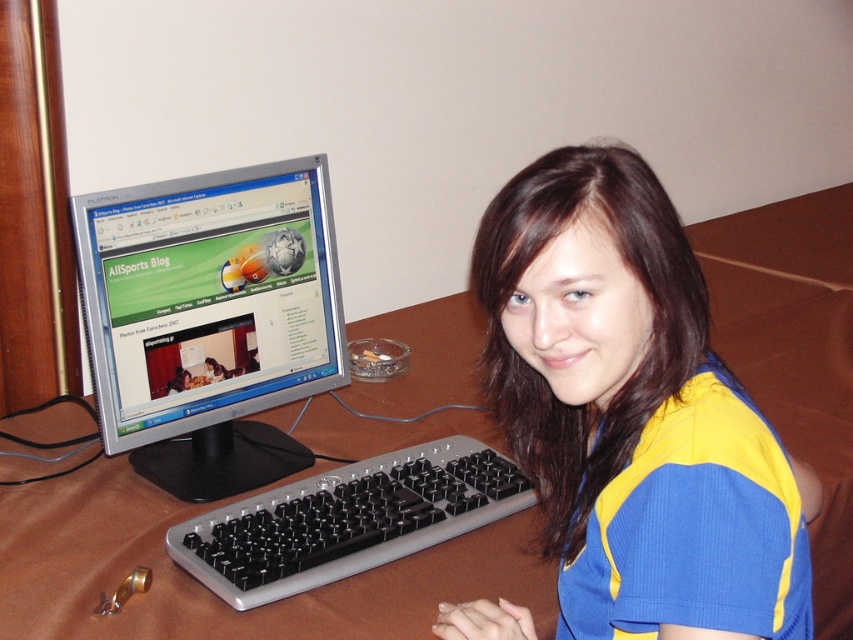
Question: Which of the following is the closest to the observer?

Choices:
 (A) (222, 307)
 (B) (705, 593)

Answer: (B)

Question: Is brown wooden computer desk at center closer to camera compared to black plastic keyboard at center?

Choices:
 (A) no
 (B) yes

Answer: (A)

Question: Is blue/yellow jersey at center to the right of satin silver monitor at center from the viewer's perspective?

Choices:
 (A) no
 (B) yes

Answer: (B)

Question: Among these points, which one is nearest to the camera?

Choices:
 (A) (259, 536)
 (B) (125, 499)
 (C) (558, 422)
 (D) (335, 276)

Answer: (C)

Question: From the image, what is the correct spatial relationship of blue/yellow jersey at center in relation to black plastic keyboard at center?

Choices:
 (A) left
 (B) right

Answer: (B)

Question: Which object is closer to the camera taking this photo?

Choices:
 (A) brown wooden computer desk at center
 (B) blue/yellow jersey at center
 (C) black plastic keyboard at center

Answer: (B)